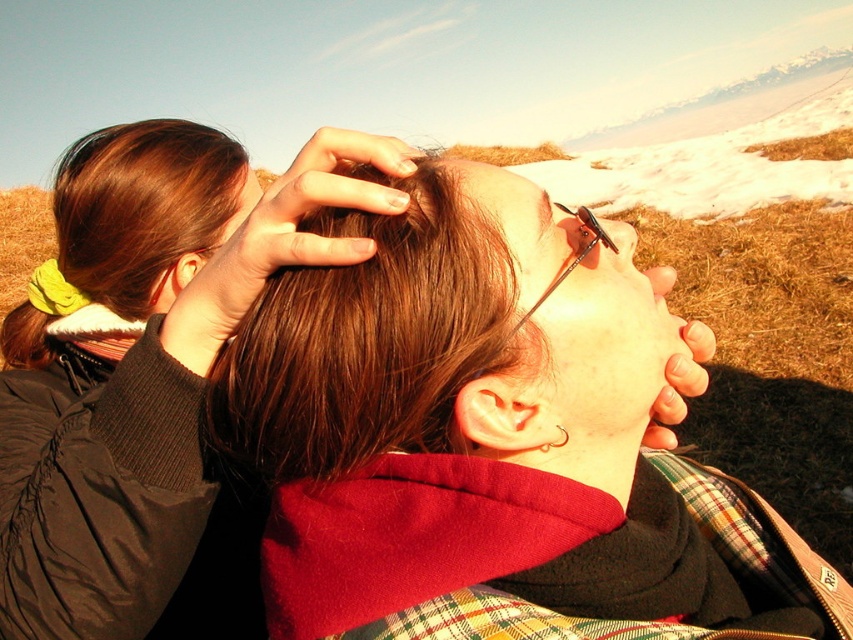
Who is more distant from viewer, (521, 180) or (583, 205)?

The point (583, 205) is behind.

Is point (496, 177) positioned behind point (585, 211)?

No, it is not.

Image resolution: width=853 pixels, height=640 pixels. What do you see at coordinates (497, 200) in the screenshot?
I see `smooth brown hair at center` at bounding box center [497, 200].

This screenshot has height=640, width=853. I want to click on smooth brown hair at center, so click(497, 200).

Is matte black jacket at upper left to the left of black plastic goggles at center from the viewer's perspective?

Indeed, matte black jacket at upper left is positioned on the left side of black plastic goggles at center.

Can you confirm if matte black jacket at upper left is positioned below black plastic goggles at center?

Correct, matte black jacket at upper left is located below black plastic goggles at center.

What do you see at coordinates (149, 380) in the screenshot? I see `matte black jacket at upper left` at bounding box center [149, 380].

Find the location of a particular element. The image size is (853, 640). matte black jacket at upper left is located at coordinates (149, 380).

Does matte red fleece at center have a larger size compared to matte black jacket at upper left?

Actually, matte red fleece at center might be smaller than matte black jacket at upper left.

Is matte red fleece at center smaller than matte black jacket at upper left?

Indeed, matte red fleece at center has a smaller size compared to matte black jacket at upper left.

Who is more distant from viewer, (x=540, y=321) or (x=65, y=339)?

The point (x=65, y=339) is behind.

Identify the location of matte red fleece at center. (460, 422).